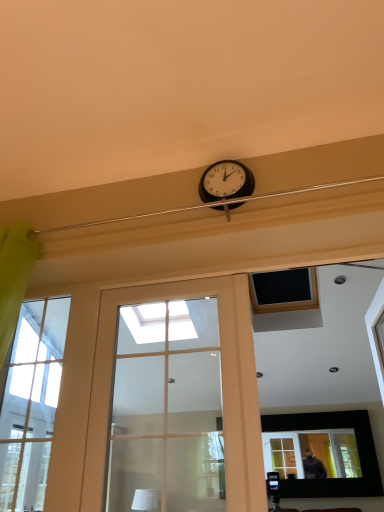
Locate an element on the screen. The image size is (384, 512). clear glass window at left is located at coordinates (31, 403).

What's the angular difference between white matte lampshade at upper center and matte glass door at center's facing directions?

29.6 degrees separate the facing orientations of white matte lampshade at upper center and matte glass door at center.

Does white matte lampshade at upper center touch matte glass door at center?

white matte lampshade at upper center is not next to matte glass door at center, and they're not touching.

Which of these two, white matte lampshade at upper center or matte glass door at center, is wider?

With larger width is white matte lampshade at upper center.

Identify the location of door on the right side of white matte lampshade at upper center. (113, 362).

Which object is thinner, white matte lampshade at upper center or black plastic clock at upper center?

With smaller width is black plastic clock at upper center.

Is white matte lampshade at upper center spatially inside black plastic clock at upper center, or outside of it?

The correct answer is: outside.

Is white matte lampshade at upper center to the left of black plastic clock at upper center from the viewer's perspective?

Correct, you'll find white matte lampshade at upper center to the left of black plastic clock at upper center.

From the image's perspective, does white matte lampshade at upper center appear lower than black plastic clock at upper center?

Yes, from the image's perspective, white matte lampshade at upper center is below black plastic clock at upper center.

Which of these two, white matte lampshade at upper center or matte black picture frame at upper center, is bigger?

With larger size is matte black picture frame at upper center.

From the picture: Is white matte lampshade at upper center not near matte black picture frame at upper center?

Indeed, white matte lampshade at upper center is not near matte black picture frame at upper center.

Does point (137, 506) appear closer or farther from the camera than point (311, 485)?

Point (137, 506).

Locate an element on the screen. The image size is (384, 512). picture frame that appears on the right of white matte lampshade at upper center is located at coordinates (357, 446).

Considering the relative positions of white matte lampshade at upper center and clear glass window at left in the image provided, is white matte lampshade at upper center to the left of clear glass window at left from the viewer's perspective?

No, white matte lampshade at upper center is not to the left of clear glass window at left.

Which is farther from the camera, (140, 509) or (2, 433)?

The point (2, 433) is behind.

Based on the photo, is white matte lampshade at upper center with clear glass window at left?

No.

Does white matte lampshade at upper center have a greater height compared to clear glass window at left?

No.

Is clear glass window at left spatially inside matte black picture frame at upper center, or outside of it?

clear glass window at left is outside matte black picture frame at upper center.

Can you confirm if clear glass window at left is thinner than matte black picture frame at upper center?

No, clear glass window at left is not thinner than matte black picture frame at upper center.

From the image's perspective, which object appears higher, clear glass window at left or matte black picture frame at upper center?

From the image's view, clear glass window at left is above.

Which point is more distant from viewer, (39, 374) or (363, 426)?

The point (363, 426) is farther from the camera.

Considering the relative sizes of clear glass window at left and white matte lampshade at upper center in the image provided, is clear glass window at left taller than white matte lampshade at upper center?

Correct, clear glass window at left is much taller as white matte lampshade at upper center.

From the picture: From a real-world perspective, is clear glass window at left on top of white matte lampshade at upper center?

Yes, from a real-world perspective, clear glass window at left is over white matte lampshade at upper center

Does clear glass window at left appear on the right side of white matte lampshade at upper center?

No.

Is clear glass window at left situated inside white matte lampshade at upper center or outside?

clear glass window at left exists outside the volume of white matte lampshade at upper center.

Is white matte lampshade at upper center located within matte black picture frame at upper center?

No.

Considering the relative positions of matte black picture frame at upper center and white matte lampshade at upper center in the image provided, is matte black picture frame at upper center to the left or to the right of white matte lampshade at upper center?

Based on their positions, matte black picture frame at upper center is located to the right of white matte lampshade at upper center.

Considering the relative sizes of matte black picture frame at upper center and white matte lampshade at upper center in the image provided, is matte black picture frame at upper center shorter than white matte lampshade at upper center?

Incorrect, the height of matte black picture frame at upper center does not fall short of that of white matte lampshade at upper center.

Which object is further away from the camera, matte black picture frame at upper center or white matte lampshade at upper center?

white matte lampshade at upper center is more distant.

This screenshot has width=384, height=512. Identify the location of door on the right of white matte lampshade at upper center. (113, 362).

Locate an element on the screen. lamp directly beneath the black plastic clock at upper center (from a real-world perspective) is located at coordinates (144, 500).

Considering their positions, is black plastic clock at upper center positioned closer to matte black picture frame at upper center than matte glass door at center?

matte glass door at center is positioned closer to the anchor matte black picture frame at upper center.

From the image, which object appears to be farther from matte black picture frame at upper center, white matte lampshade at upper center or black plastic clock at upper center?

black plastic clock at upper center lies further to matte black picture frame at upper center than the other object.

When comparing their distances from matte black picture frame at upper center, does matte glass door at center or white matte lampshade at upper center seem closer?

The object closer to matte black picture frame at upper center is white matte lampshade at upper center.

Estimate the real-world distances between objects in this image. Which object is further from clear glass window at left, white matte lampshade at upper center or black plastic clock at upper center?

black plastic clock at upper center is positioned further to the anchor clear glass window at left.

Considering their positions, is black plastic clock at upper center positioned further to clear glass window at left than matte glass door at center?

Among the two, black plastic clock at upper center is located further to clear glass window at left.

When comparing their distances from clear glass window at left, does matte glass door at center or white matte lampshade at upper center seem further?

white matte lampshade at upper center lies further to clear glass window at left than the other object.

Consider the image. Based on their spatial positions, is matte glass door at center or matte black picture frame at upper center closer to clear glass window at left?

matte glass door at center is closer to clear glass window at left.

Consider the image. Looking at the image, which one is located closer to matte black picture frame at upper center, clear glass window at left or black plastic clock at upper center?

clear glass window at left is closer to matte black picture frame at upper center.

Where is `clock between matte glass door at center and white matte lampshade at upper center from front to back`? clock between matte glass door at center and white matte lampshade at upper center from front to back is located at coordinates (226, 181).

Where is `picture frame between clear glass window at left and white matte lampshade at upper center from front to back`? The width and height of the screenshot is (384, 512). picture frame between clear glass window at left and white matte lampshade at upper center from front to back is located at coordinates (357, 446).

Locate an element on the screen. This screenshot has width=384, height=512. door between black plastic clock at upper center and clear glass window at left in the vertical direction is located at coordinates pyautogui.click(x=113, y=362).

Locate an element on the screen. Image resolution: width=384 pixels, height=512 pixels. window between matte glass door at center and white matte lampshade at upper center from front to back is located at coordinates (31, 403).